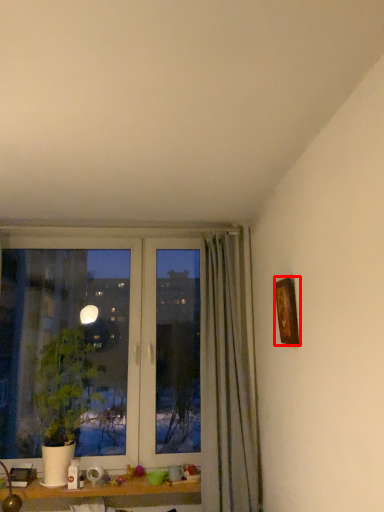
Question: In this image, where is picture frame (annotated by the red box) located relative to houseplant?

Choices:
 (A) right
 (B) left

Answer: (A)